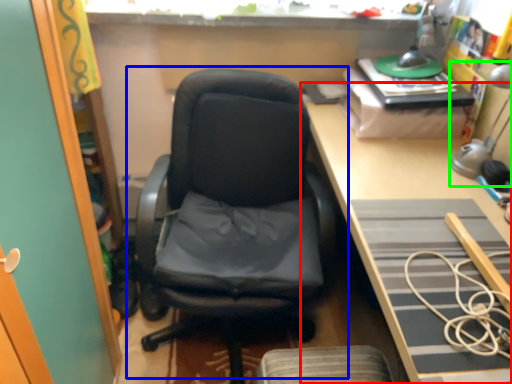
Question: Which object is the farthest from desk (highlighted by a red box)? Choose among these: chair (highlighted by a blue box) or table lamp (highlighted by a green box).

Choices:
 (A) chair
 (B) table lamp

Answer: (A)